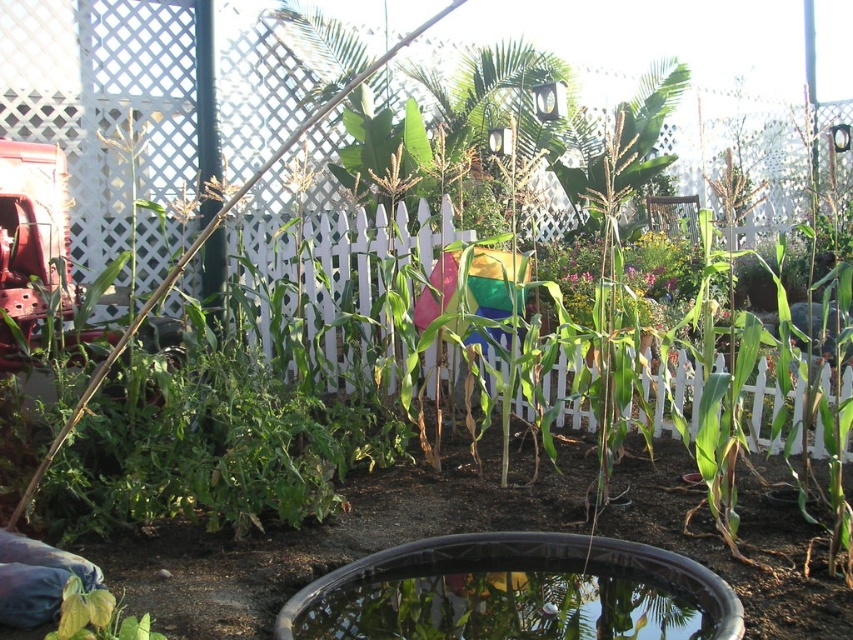
Based on the photo, you are standing in the garden and want to water the green leafy plant at lower left and the black rubber fish pond at lower center. Which object should you approach first if you are coming from the left side of the garden?

The green leafy plant at lower left should be approached first since it is located to the left of the black rubber fish pond at lower center.

You are a gardener who needs to place a 1.20 meter long hose between the black rubber fish pond at lower center and the green leafy plant at lower left. Will the hose reach both objects without needing to move them?

The distance between the black rubber fish pond at lower center and the green leafy plant at lower left is 1.10 meters. Since the hose is 1.20 meters long, it will reach both objects with some extra length remaining.